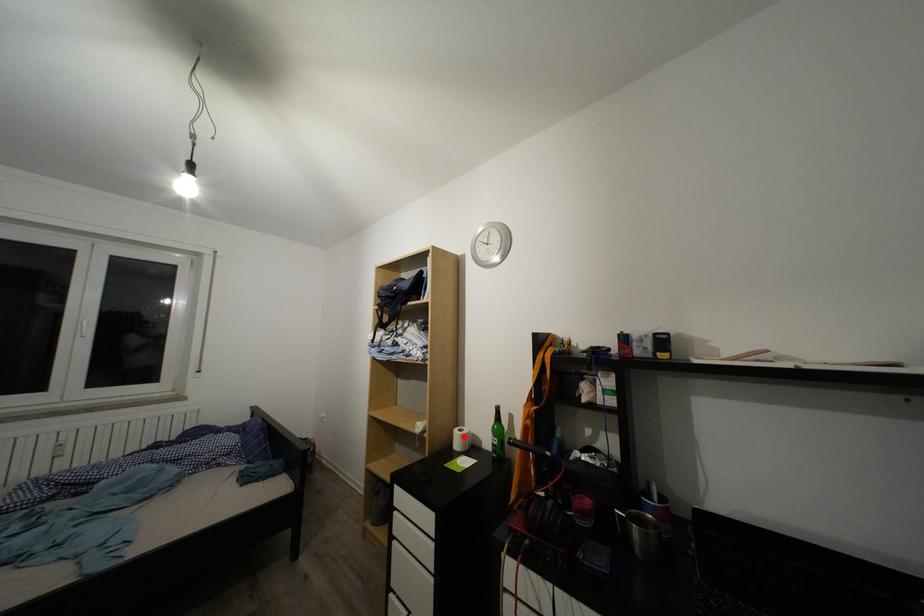
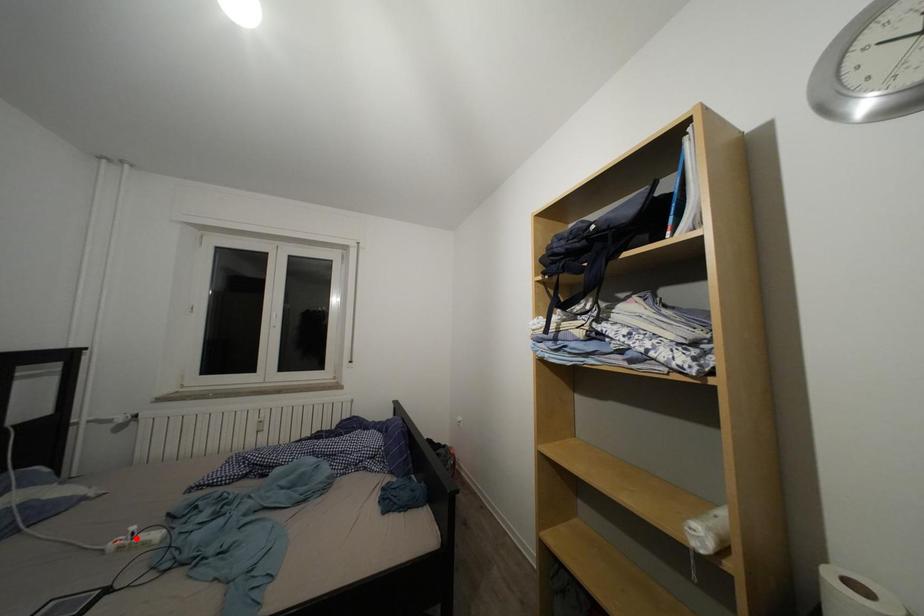
I am providing you with two images of the same scene from different viewpoints. A red point is marked on the first image and another point is marked on the second image. Are the points marked in image1 and image2 representing the same 3D position?

No